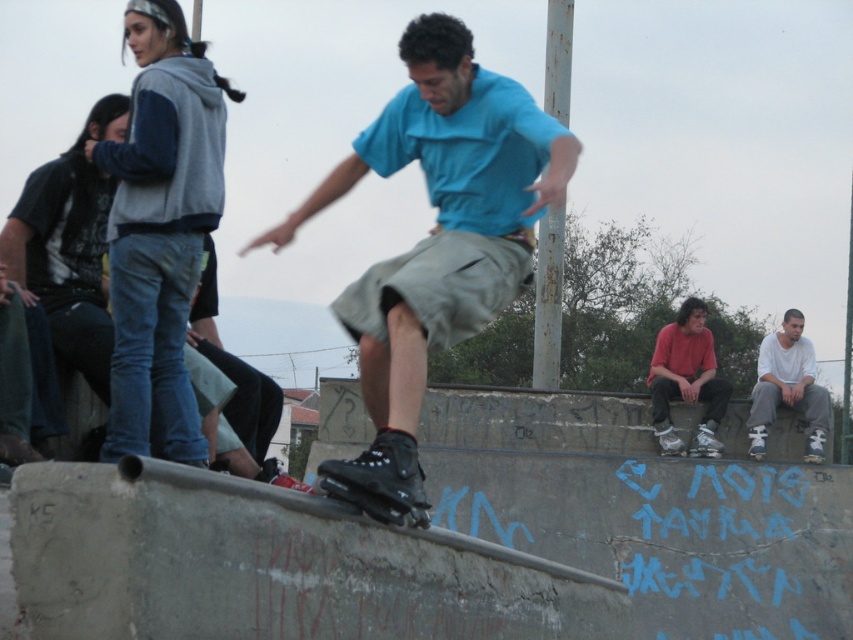
Which of these two, matte blue shirt at center or black matte skateboard at center, stands taller?

matte blue shirt at center is taller.

Is point (480, 140) less distant than point (346, 483)?

No, it is behind (346, 483).

Is point (444, 173) positioned before point (428, 525)?

No, (444, 173) is further to viewer.

This screenshot has width=853, height=640. I want to click on matte blue shirt at center, so click(439, 227).

The width and height of the screenshot is (853, 640). What do you see at coordinates (686, 380) in the screenshot?
I see `red matte shirt at center` at bounding box center [686, 380].

Does red matte shirt at center have a smaller size compared to black matte skateboard at center?

Actually, red matte shirt at center might be larger than black matte skateboard at center.

Image resolution: width=853 pixels, height=640 pixels. I want to click on red matte shirt at center, so click(686, 380).

Identify the location of red matte shirt at center. (686, 380).

Is red matte shirt at center shorter than white matte shirt at lower right?

No.

Is red matte shirt at center bigger than white matte shirt at lower right?

Incorrect, red matte shirt at center is not larger than white matte shirt at lower right.

Is point (712, 380) positioned after point (799, 371)?

No, (712, 380) is in front of (799, 371).

Where is `red matte shirt at center`? The width and height of the screenshot is (853, 640). red matte shirt at center is located at coordinates (686, 380).